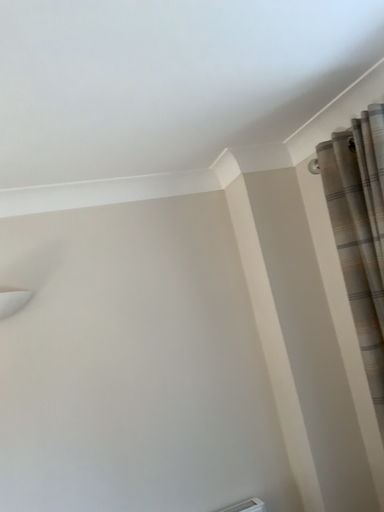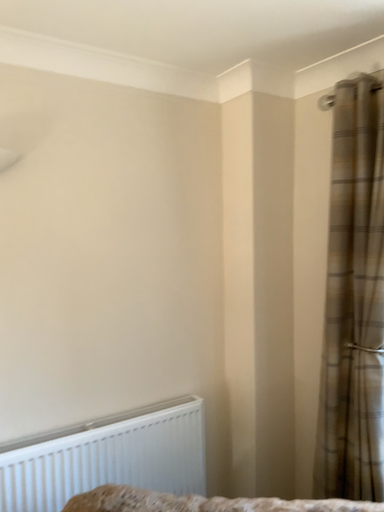
Question: Which way did the camera rotate in the video?

Choices:
 (A) rotated upward
 (B) rotated downward

Answer: (B)